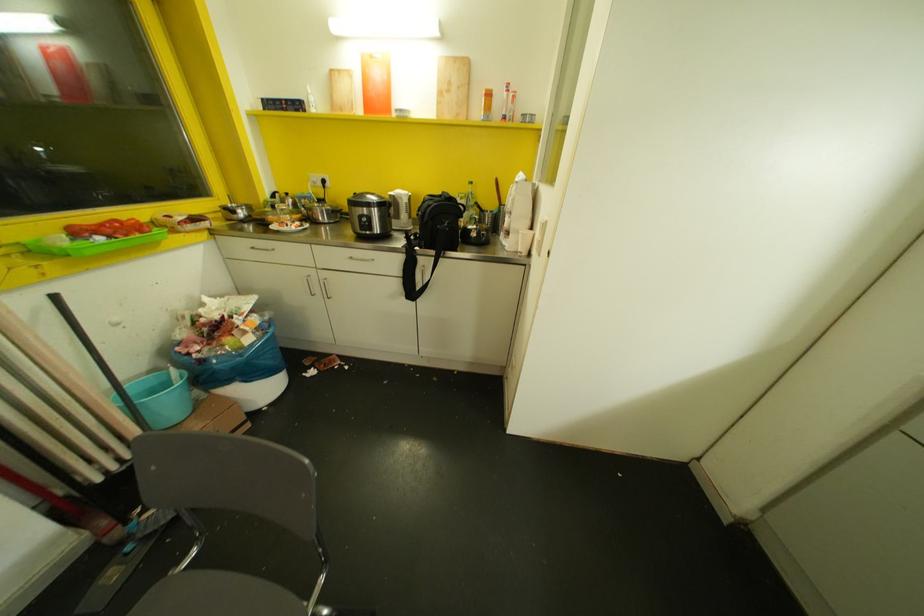
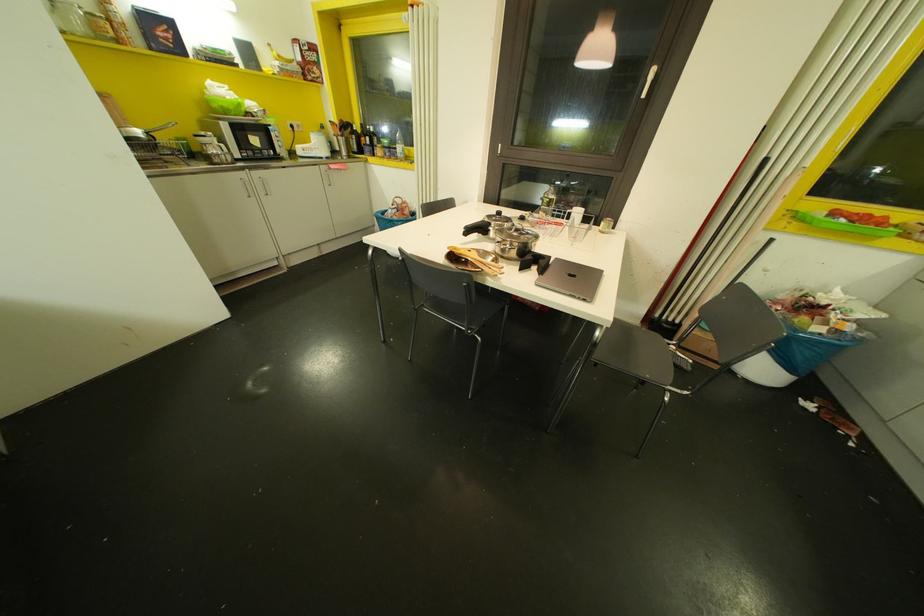
The first image is from the beginning of the video and the second image is from the end. How did the camera likely rotate when shooting the video?

The camera's rotation is toward left-down.